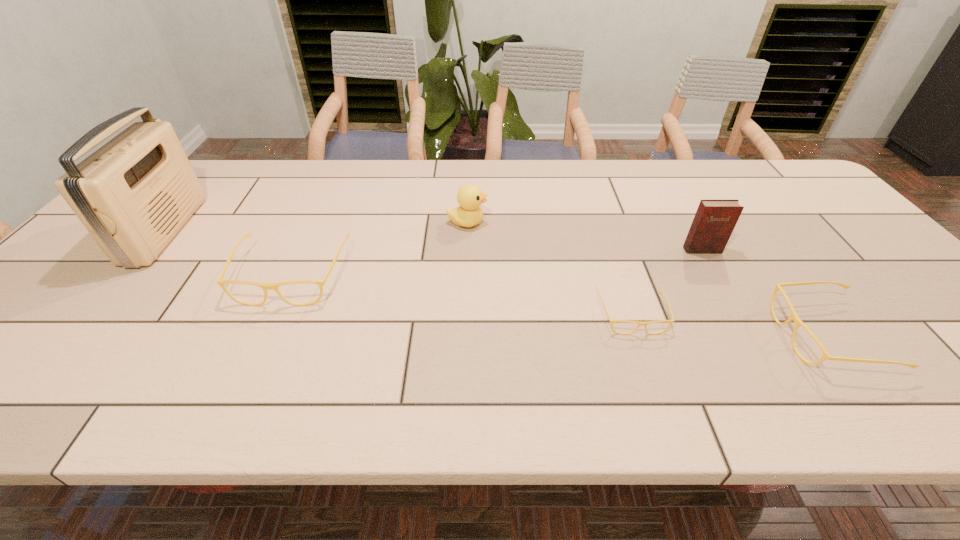
The width and height of the screenshot is (960, 540). I want to click on object that is at the far left corner, so click(x=133, y=194).

What are the coordinates of `vacant space at the far edge of the desktop` in the screenshot? It's located at (302, 172).

Locate an element on the screen. The height and width of the screenshot is (540, 960). free region at the near edge of the desktop is located at coordinates (614, 340).

The width and height of the screenshot is (960, 540). In the image, there is a desktop. In order to click on vacant area at the right edge in this screenshot , I will do `click(896, 323)`.

Locate an element on the screen. This screenshot has height=540, width=960. vacant space in between the fifth object from left to right and the duck is located at coordinates (585, 236).

At what (x,y) coordinates should I click in order to perform the action: click on free spot between the second tallest object and the fifth object from right to left. Please return your answer as a coordinate pair (x, y). The height and width of the screenshot is (540, 960). Looking at the image, I should click on (497, 262).

Where is `vacant space that's between the second spectacles from right to left and the second shortest object`? This screenshot has height=540, width=960. vacant space that's between the second spectacles from right to left and the second shortest object is located at coordinates (729, 325).

I want to click on vacant space that is in between the fourth object from right to left and the second object from left to right, so click(380, 249).

Where is `free point between the second spectacles from left to right and the second shortest object`? This screenshot has height=540, width=960. free point between the second spectacles from left to right and the second shortest object is located at coordinates coord(729,325).

What are the coordinates of `empty location between the second object from left to right and the second tallest spectacles` in the screenshot? It's located at (560, 306).